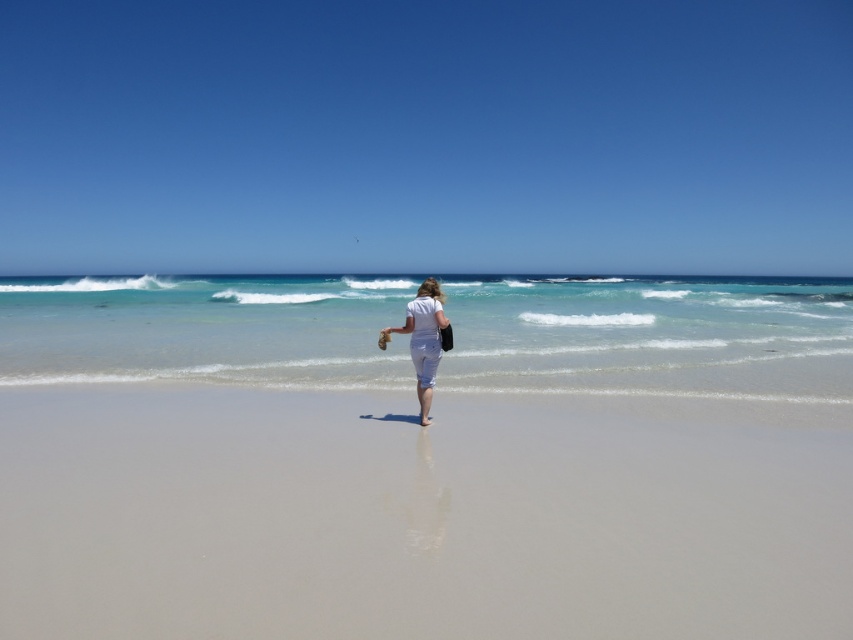
Question: Among these points, which one is nearest to the camera?

Choices:
 (A) (166, 497)
 (B) (425, 307)

Answer: (A)

Question: Observing the image, what is the correct spatial positioning of smooth sand at center in reference to white cotton pants at center?

Choices:
 (A) below
 (B) above

Answer: (A)

Question: Which object is the farthest from the clear blue water at center?

Choices:
 (A) white cotton pants at center
 (B) smooth sand at center

Answer: (A)

Question: Is smooth sand at center above white cotton pants at center?

Choices:
 (A) no
 (B) yes

Answer: (A)

Question: Can you confirm if clear blue water at center is positioned above white cotton pants at center?

Choices:
 (A) yes
 (B) no

Answer: (A)

Question: Which of the following is the farthest from the observer?

Choices:
 (A) smooth sand at center
 (B) white cotton pants at center

Answer: (B)